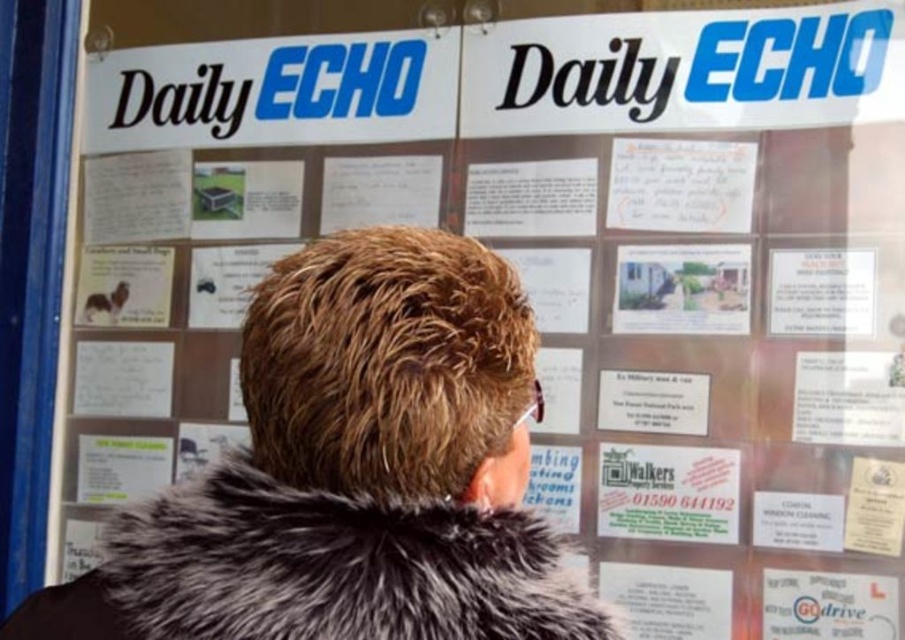
In the scene shown: You are standing in front of the noticeboard and want to reach the point at coordinate point (215, 560). However, there is an obstacle at point point (246, 536). Can you directly reach the first point without moving around the obstacle?

Point (215, 560) is behind point (246, 536), so you cannot directly reach the first point without moving around the obstacle.

You are a fashion designer observing the noticeboard scene. You need to determine if two coats displayed on the noticeboard can be placed side by side in a store window that is 3 inches wide. The coats are the brown fur coat at center and the fuzzy gray fur coat at center. Can they fit without overlapping?

The brown fur coat at center and fuzzy gray fur coat at center are 1.54 inches apart from each other. Since the total required space is 1.54 inches and the store window is 3 inches wide, they can fit side by side with enough space between them.